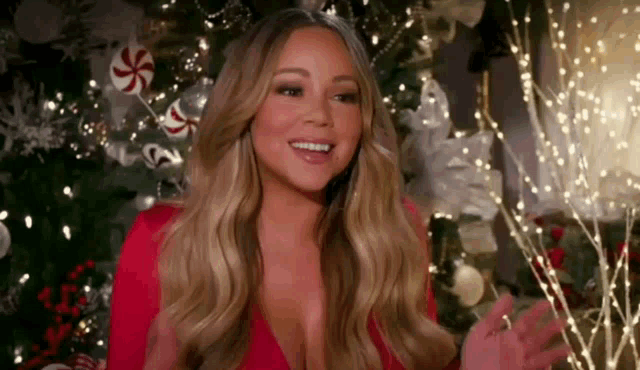
Identify the location of lights. (570, 164), (200, 71), (33, 228).